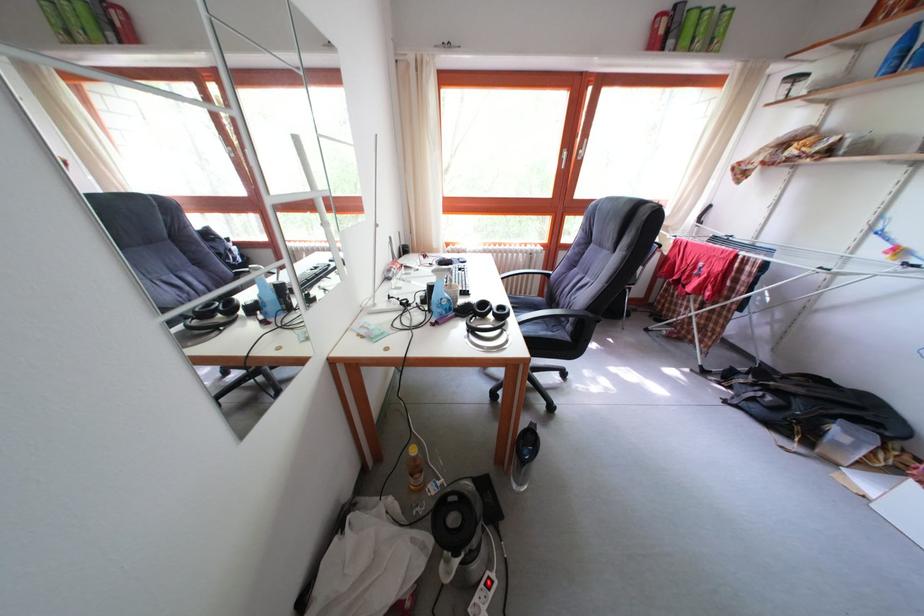
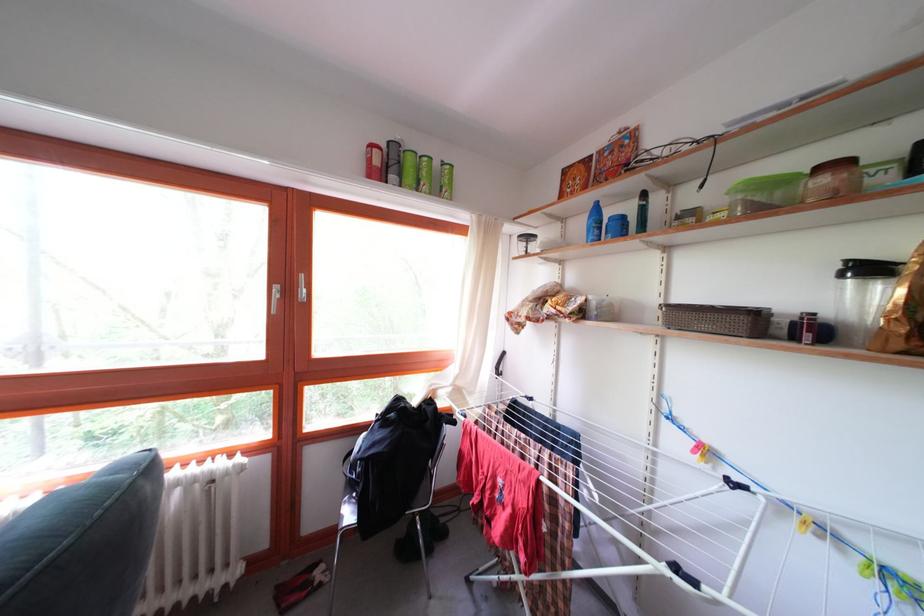
Where in the second image is the point corresponding to point 686,45 from the first image?

(409, 180)